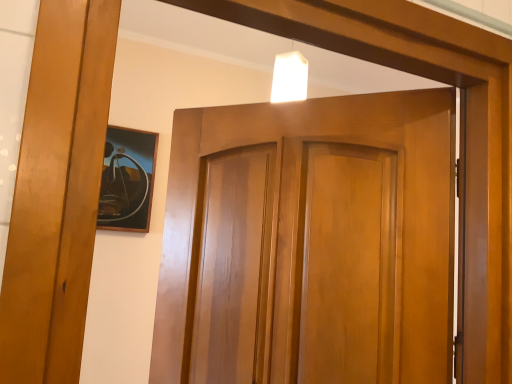
You are a GUI agent. You are given a task and a screenshot of the screen. Output one action in this format:
    pyautogui.click(x=<x>, y=<y>)
    Task: Click on the glossy wood door at center
    This screenshot has width=512, height=384.
    Given the screenshot: What is the action you would take?
    pyautogui.click(x=279, y=148)

Image resolution: width=512 pixels, height=384 pixels. Describe the element at coordinates (279, 148) in the screenshot. I see `glossy wood door at center` at that location.

The image size is (512, 384). I want to click on glossy wood door at center, so click(279, 148).